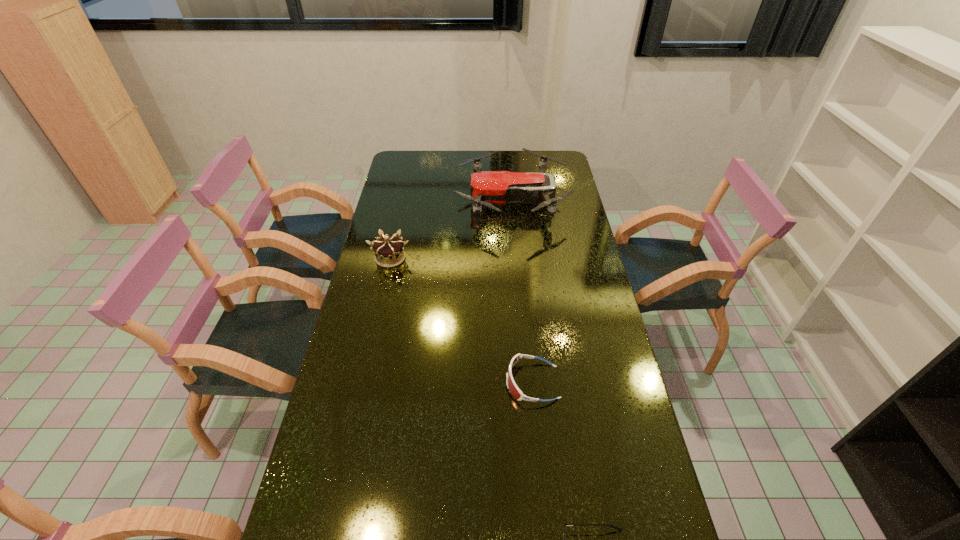
Where is `vacant area situated on the front-facing side of the goggles`? This screenshot has height=540, width=960. vacant area situated on the front-facing side of the goggles is located at coordinates (489, 382).

At what (x,y) coordinates should I click in order to perform the action: click on vacant space located 0.140m on the front-facing side of the goggles. Please return your answer as a coordinate pair (x, y). Looking at the image, I should click on (457, 382).

I want to click on free spot located on the front-facing side of the goggles, so click(478, 382).

Locate an element on the screen. object situated at the far edge is located at coordinates (488, 188).

Locate an element on the screen. This screenshot has width=960, height=540. object that is at the left edge is located at coordinates (389, 252).

Where is `object present at the right edge`? The image size is (960, 540). object present at the right edge is located at coordinates (488, 188).

I want to click on object situated at the far right corner, so click(x=488, y=188).

Where is `free region at the far edge`? The width and height of the screenshot is (960, 540). free region at the far edge is located at coordinates (492, 166).

This screenshot has width=960, height=540. In the image, there is a desktop. In order to click on vacant space at the left edge in this screenshot , I will do `click(372, 310)`.

Identify the location of vacant space at the right edge. (566, 299).